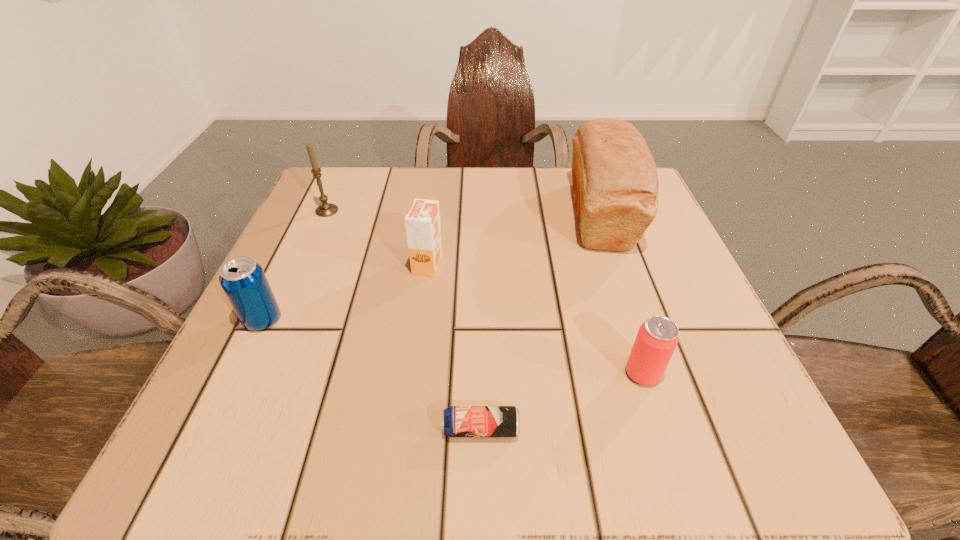
What are the coordinates of `beer can at the right edge` in the screenshot? It's located at (657, 338).

This screenshot has width=960, height=540. What are the coordinates of `object that is at the far left corner` in the screenshot? It's located at (325, 209).

You are a GUI agent. You are given a task and a screenshot of the screen. Output one action in this format:
    pyautogui.click(x=<x>, y=<y>)
    Task: Click on the object located at the far right corner
    
    Given the screenshot: What is the action you would take?
    pyautogui.click(x=615, y=184)

Where is `vacant region at the far edge of the desktop`? The width and height of the screenshot is (960, 540). vacant region at the far edge of the desktop is located at coordinates (407, 204).

Image resolution: width=960 pixels, height=540 pixels. Find the location of `free space at the near edge of the desktop`. free space at the near edge of the desktop is located at coordinates (371, 469).

Where is `vacant region at the left edge of the desktop`? The image size is (960, 540). vacant region at the left edge of the desktop is located at coordinates (205, 403).

In the image, there is a desktop. Where is `vacant space at the far left corner`? vacant space at the far left corner is located at coordinates (327, 202).

Identify the location of free space at the near left corner. (250, 416).

In the image, there is a desktop. Where is `vacant space at the near right corner`? vacant space at the near right corner is located at coordinates (770, 450).

The width and height of the screenshot is (960, 540). What are the coordinates of `vacant space that's between the bread and the nearest object` in the screenshot? It's located at (540, 322).